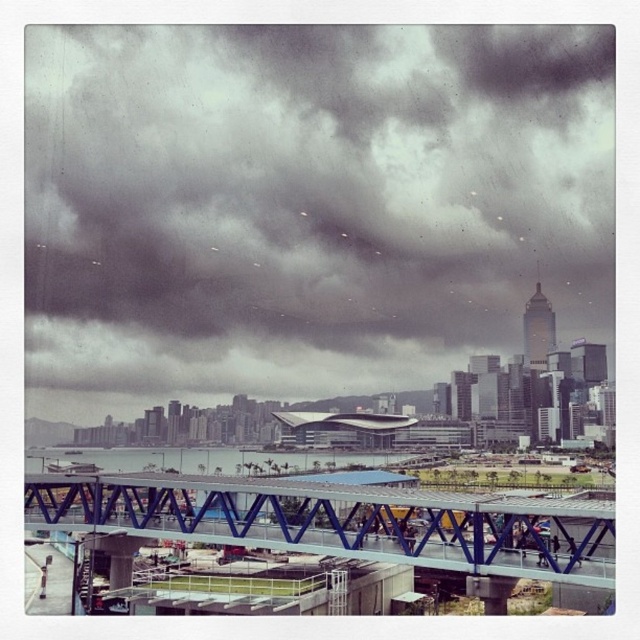
Question: Is blue metallic bridge at center to the left of transparent glass water at center from the viewer's perspective?

Choices:
 (A) no
 (B) yes

Answer: (A)

Question: Which point is closer to the camera?

Choices:
 (A) blue metallic bridge at center
 (B) dark gray cloud at upper center
 (C) transparent glass water at center

Answer: (A)

Question: From the image, what is the correct spatial relationship of dark gray cloud at upper center in relation to blue metallic bridge at center?

Choices:
 (A) above
 (B) below

Answer: (A)

Question: Which point is closer to the camera?

Choices:
 (A) (220, 118)
 (B) (113, 470)

Answer: (B)

Question: Does blue metallic bridge at center come in front of transparent glass water at center?

Choices:
 (A) no
 (B) yes

Answer: (B)

Question: Estimate the real-world distances between objects in this image. Which object is closer to the dark gray cloud at upper center?

Choices:
 (A) transparent glass water at center
 (B) blue metallic bridge at center

Answer: (A)